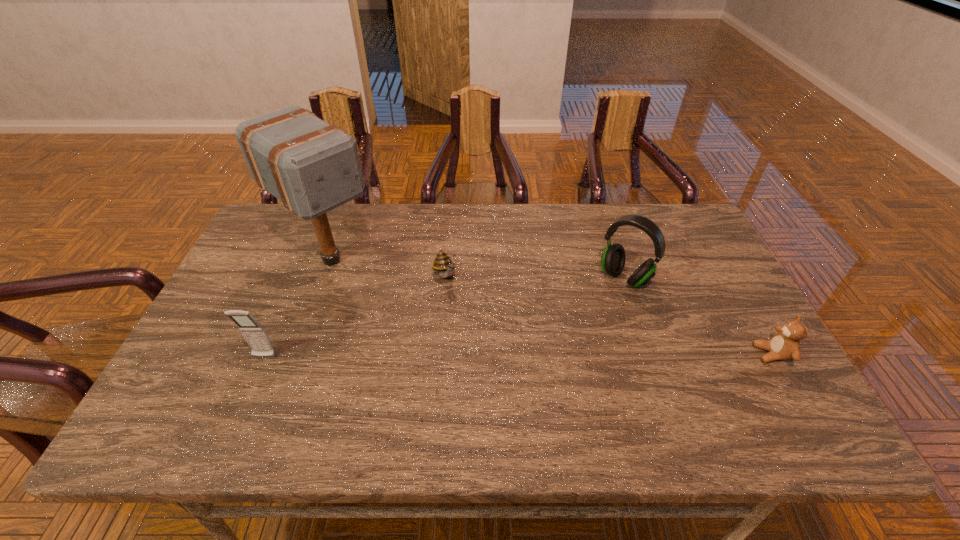
The image size is (960, 540). What are the coordinates of `free space that is in between the tallest object and the rightmost object` in the screenshot? It's located at (552, 307).

Locate an element on the screen. The image size is (960, 540). the fourth closest object to the snail is located at coordinates (785, 345).

In order to click on object that is the closest to the headset in this screenshot , I will do `click(785, 345)`.

At what (x,y) coordinates should I click in order to perform the action: click on free space in the image that satisfies the following two spatial constraints: 1. on the front side of the rightmost object; 2. on the front-facing side of the fourth object from left to right. Please return your answer as a coordinate pair (x, y). The width and height of the screenshot is (960, 540). Looking at the image, I should click on (650, 354).